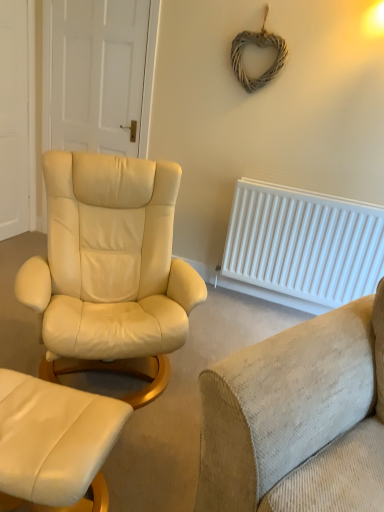
Image resolution: width=384 pixels, height=512 pixels. What do you see at coordinates (304, 244) in the screenshot?
I see `white plastic radiator at right` at bounding box center [304, 244].

Measure the distance between white wooden door at left, acting as the second door starting from the right, and camera.

A distance of 9.04 feet exists between white wooden door at left, acting as the second door starting from the right, and camera.

Where is `white plastic radiator at right`? The height and width of the screenshot is (512, 384). white plastic radiator at right is located at coordinates (304, 244).

Which object is wider, white plastic radiator at right or white wooden door at left, the first door from the left?

white plastic radiator at right is wider.

Is white plastic radiator at right positioned with its back to white wooden door at left, the first door from the left?

No.

This screenshot has width=384, height=512. I want to click on door that is the 1st object located above the white plastic radiator at right (from the image's perspective), so click(17, 117).

Considering the relative positions of white plastic radiator at right and white wooden door at left, the first door from the left, in the image provided, is white plastic radiator at right to the right of white wooden door at left, the first door from the left, from the viewer's perspective?

Yes, white plastic radiator at right is to the right of white wooden door at left, the first door from the left.

From the image's perspective, relative to white plastic radiator at right, is white matte door at upper left, which is the 1th door in right-to-left order, above or below?

Based on their image positions, white matte door at upper left, which is the 1th door in right-to-left order, is located above white plastic radiator at right.

Which object is thinner, white matte door at upper left, which is the 1th door in right-to-left order, or white plastic radiator at right?

With smaller width is white matte door at upper left, which is the 1th door in right-to-left order.

Where is `the 2nd door behind the white plastic radiator at right`? Image resolution: width=384 pixels, height=512 pixels. the 2nd door behind the white plastic radiator at right is located at coordinates (96, 74).

Is white matte door at upper left, which is the 1th door in right-to-left order, bigger than white plastic radiator at right?

No, white matte door at upper left, which is the 1th door in right-to-left order, is not bigger than white plastic radiator at right.

In terms of height, does white plastic radiator at right look taller or shorter compared to white matte door at upper left, which is the 1th door in right-to-left order?

white plastic radiator at right is shorter than white matte door at upper left, which is the 1th door in right-to-left order.

Is white plastic radiator at right positioned beyond the bounds of white matte door at upper left, which is the 1th door in right-to-left order?

Yes, white plastic radiator at right is not within white matte door at upper left, which is the 1th door in right-to-left order.

Considering the sizes of white plastic radiator at right and white matte door at upper left, arranged as the second door when viewed from the left, in the image, is white plastic radiator at right wider or thinner than white matte door at upper left, arranged as the second door when viewed from the left,?

In the image, white plastic radiator at right appears to be wider than white matte door at upper left, arranged as the second door when viewed from the left.

Is white wooden door at left, the first door from the left, oriented away from beige corduroy couch at lower right?

No, white wooden door at left, the first door from the left,'s orientation is not away from beige corduroy couch at lower right.

Between white wooden door at left, the first door from the left, and beige corduroy couch at lower right, which one is positioned in front?

Positioned in front is beige corduroy couch at lower right.

Between point (0, 231) and point (308, 398), which one is positioned in front?

Point (308, 398)

Which is more to the left, white wooden door at left, acting as the second door starting from the right, or beige corduroy couch at lower right?

Positioned to the left is white wooden door at left, acting as the second door starting from the right.

Looking at this image, between white wooden door at left, acting as the second door starting from the right, and white plastic radiator at right, which one appears on the right side from the viewer's perspective?

white plastic radiator at right.

Is white wooden door at left, acting as the second door starting from the right, taller or shorter than white plastic radiator at right?

Clearly, white wooden door at left, acting as the second door starting from the right, is taller compared to white plastic radiator at right.

Can you confirm if white wooden door at left, acting as the second door starting from the right, is bigger than white plastic radiator at right?

Incorrect, white wooden door at left, acting as the second door starting from the right, is not larger than white plastic radiator at right.

Is point (13, 135) positioned in front of point (271, 288)?

No, it is not.

From the image's perspective, is white matte door at upper left, arranged as the second door when viewed from the left, over matte cream leather ottoman at lower left?

Indeed, from the image's perspective, white matte door at upper left, arranged as the second door when viewed from the left, is shown above matte cream leather ottoman at lower left.

Which of these two, white matte door at upper left, arranged as the second door when viewed from the left, or matte cream leather ottoman at lower left, is bigger?

Bigger between the two is matte cream leather ottoman at lower left.

From a real-world perspective, is white matte door at upper left, which is the 1th door in right-to-left order, physically below matte cream leather ottoman at lower left?

No.

Would you consider white matte door at upper left, which is the 1th door in right-to-left order, to be distant from matte cream leather ottoman at lower left?

That's right, there is a large distance between white matte door at upper left, which is the 1th door in right-to-left order, and matte cream leather ottoman at lower left.

Is matte cream leather ottoman at lower left positioned beyond the bounds of white wooden door at left, the first door from the left?

Absolutely, matte cream leather ottoman at lower left is external to white wooden door at left, the first door from the left.

Between matte cream leather ottoman at lower left and white wooden door at left, the first door from the left, which one appears on the right side from the viewer's perspective?

matte cream leather ottoman at lower left.

Which door is the 1st one when counting from the back of the matte cream leather ottoman at lower left? Please provide its 2D coordinates.

[(17, 117)]

At what (x,y) coordinates should I click in order to perform the action: click on the 1st door above the white plastic radiator at right (from a real-world perspective). Please return your answer as a coordinate pair (x, y). Looking at the image, I should click on (17, 117).

Where is `radiator in front of the white matte door at upper left, which is the 1th door in right-to-left order`? This screenshot has height=512, width=384. radiator in front of the white matte door at upper left, which is the 1th door in right-to-left order is located at coordinates (304, 244).

When comparing their distances from beige corduroy couch at lower right, does white wooden door at left, the first door from the left, or matte cream leather ottoman at lower left seem further?

Based on the image, white wooden door at left, the first door from the left, appears to be further to beige corduroy couch at lower right.

Which object lies further to the anchor point matte cream leather ottoman at lower left, white wooden door at left, the first door from the left, or white matte door at upper left, arranged as the second door when viewed from the left?

Based on the image, white wooden door at left, the first door from the left, appears to be further to matte cream leather ottoman at lower left.

Looking at the image, which one is located further to white wooden door at left, the first door from the left, matte cream leather ottoman at lower left or white matte door at upper left, which is the 1th door in right-to-left order?

Among the two, matte cream leather ottoman at lower left is located further to white wooden door at left, the first door from the left.

When comparing their distances from white plastic radiator at right, does white wooden door at left, the first door from the left, or beige corduroy couch at lower right seem further?

white wooden door at left, the first door from the left, lies further to white plastic radiator at right than the other object.

When comparing their distances from beige corduroy couch at lower right, does matte cream leather ottoman at lower left or white wooden door at left, acting as the second door starting from the right, seem further?

The object further to beige corduroy couch at lower right is white wooden door at left, acting as the second door starting from the right.

When comparing their distances from white plastic radiator at right, does beige corduroy couch at lower right or matte cream leather ottoman at lower left seem closer?

The object closer to white plastic radiator at right is beige corduroy couch at lower right.

Looking at the image, which one is located closer to white matte door at upper left, arranged as the second door when viewed from the left, white plastic radiator at right or white wooden door at left, acting as the second door starting from the right?

Based on the image, white wooden door at left, acting as the second door starting from the right, appears to be nearer to white matte door at upper left, arranged as the second door when viewed from the left.

Estimate the real-world distances between objects in this image. Which object is further from white matte door at upper left, which is the 1th door in right-to-left order, matte cream leather ottoman at lower left or white wooden door at left, the first door from the left?

Among the two, matte cream leather ottoman at lower left is located further to white matte door at upper left, which is the 1th door in right-to-left order.

You are a GUI agent. You are given a task and a screenshot of the screen. Output one action in this format:
    pyautogui.click(x=<x>, y=<y>)
    Task: Click on the door between beige corduroy couch at lower right and white matte door at upper left, which is the 1th door in right-to-left order, from front to back
    The width and height of the screenshot is (384, 512).
    Given the screenshot: What is the action you would take?
    pyautogui.click(x=17, y=117)

Image resolution: width=384 pixels, height=512 pixels. What are the coordinates of `door between white matte door at upper left, which is the 1th door in right-to-left order, and matte cream leather ottoman at lower left, in the vertical direction` in the screenshot? It's located at (17, 117).

Locate an element on the screen. radiator that lies between white matte door at upper left, which is the 1th door in right-to-left order, and matte cream leather ottoman at lower left from top to bottom is located at coordinates tap(304, 244).

At what (x,y) coordinates should I click in order to perform the action: click on door located between white wooden door at left, acting as the second door starting from the right, and white plastic radiator at right in the left-right direction. Please return your answer as a coordinate pair (x, y). Looking at the image, I should click on (96, 74).